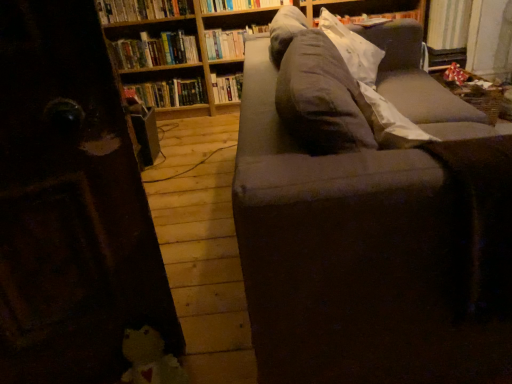
Question: Is hardcover books at upper left, the second book from the top, thinner than hardcover book at center, arranged as the sixth book when viewed from the top?

Choices:
 (A) yes
 (B) no

Answer: (B)

Question: Does hardcover books at upper left, the second book from the top, have a greater width compared to hardcover book at center, arranged as the sixth book when viewed from the top?

Choices:
 (A) no
 (B) yes

Answer: (B)

Question: Is hardcover book at center, positioned as the first book in bottom-to-top order, at the back of hardcover books at upper left, the second book from the top?

Choices:
 (A) yes
 (B) no

Answer: (B)

Question: From a real-world perspective, is hardcover books at upper left, the 5th book ordered from the bottom, physically above hardcover book at center, positioned as the first book in bottom-to-top order?

Choices:
 (A) yes
 (B) no

Answer: (A)

Question: Is hardcover books at upper left, the 5th book ordered from the bottom, completely or partially outside of hardcover book at center, arranged as the sixth book when viewed from the top?

Choices:
 (A) no
 (B) yes

Answer: (B)

Question: Is hardcover books at upper left, the second book from the top, bigger or smaller than hardcover book at upper left, which appears as the fourth book when viewed from the top?

Choices:
 (A) small
 (B) big

Answer: (A)

Question: Relative to hardcover book at upper left, the third book positioned from the bottom, is hardcover books at upper left, the 5th book ordered from the bottom, in front or behind?

Choices:
 (A) front
 (B) behind

Answer: (A)

Question: Is hardcover books at upper left, the 5th book ordered from the bottom, wider or thinner than hardcover book at upper left, which appears as the fourth book when viewed from the top?

Choices:
 (A) wide
 (B) thin

Answer: (B)

Question: Considering the positions of point (151, 13) and point (197, 61), is point (151, 13) closer or farther from the camera than point (197, 61)?

Choices:
 (A) farther
 (B) closer

Answer: (B)

Question: Is point (151, 96) positioned closer to the camera than point (140, 327)?

Choices:
 (A) farther
 (B) closer

Answer: (A)

Question: Is wooden bookcase at upper center inside or outside of fluffy white plush at lower left?

Choices:
 (A) outside
 (B) inside

Answer: (A)

Question: Visually, is wooden bookcase at upper center positioned to the left or to the right of fluffy white plush at lower left?

Choices:
 (A) right
 (B) left

Answer: (A)

Question: From the image's perspective, is wooden bookcase at upper center above or below fluffy white plush at lower left?

Choices:
 (A) below
 (B) above

Answer: (B)

Question: Is point (167, 382) closer or farther from the camera than point (332, 23)?

Choices:
 (A) farther
 (B) closer

Answer: (B)

Question: In the image, is fluffy white plush at lower left positioned in front of or behind gray fabric pillow at upper right?

Choices:
 (A) behind
 (B) front

Answer: (B)